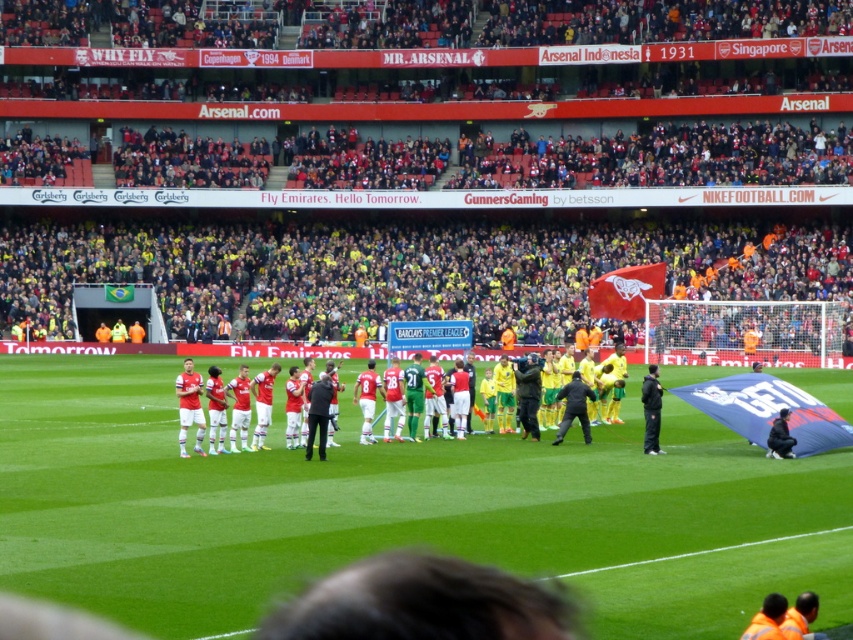
Which of these two, green grass field at center or red jersey uniform at center, stands shorter?

Standing shorter between the two is red jersey uniform at center.

Is point (483, 538) positioned behind point (192, 346)?

No, (483, 538) is in front of (192, 346).

Identify the location of green grass field at center. The width and height of the screenshot is (853, 640). (399, 509).